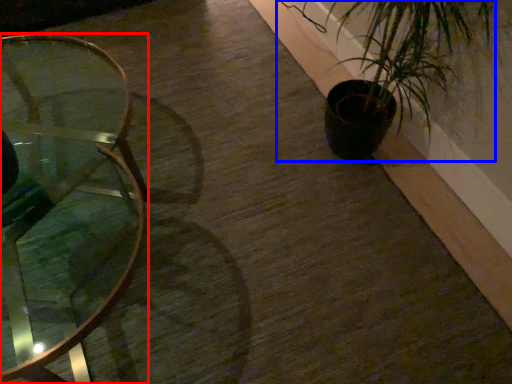
Question: Which point is further to the camera, table (highlighted by a red box) or houseplant (highlighted by a blue box)?

Choices:
 (A) table
 (B) houseplant

Answer: (B)